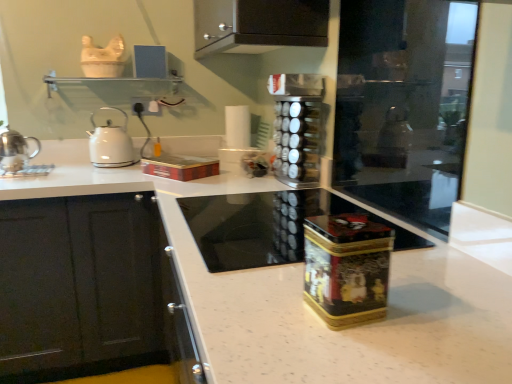
Question: Does metallic red box at center have a lesser height compared to white speckled granite at center?

Choices:
 (A) yes
 (B) no

Answer: (A)

Question: From the image's perspective, is metallic red box at center on top of white speckled granite at center?

Choices:
 (A) yes
 (B) no

Answer: (A)

Question: Is metallic red box at center positioned behind white speckled granite at center?

Choices:
 (A) yes
 (B) no

Answer: (A)

Question: Is white speckled granite at center inside metallic red box at center?

Choices:
 (A) yes
 (B) no

Answer: (B)

Question: Can you confirm if metallic red box at center is taller than white speckled granite at center?

Choices:
 (A) no
 (B) yes

Answer: (A)

Question: From the image's perspective, is metallic red box at center beneath white speckled granite at center?

Choices:
 (A) no
 (B) yes

Answer: (A)

Question: Is metallic red box at center positioned in front of metallic gold and black tin at center, which appears as the 2th appliance when viewed from the top?

Choices:
 (A) no
 (B) yes

Answer: (A)

Question: Could you tell me if metallic red box at center is facing metallic gold and black tin at center, which appears as the 2th appliance when viewed from the top?

Choices:
 (A) no
 (B) yes

Answer: (A)

Question: Are metallic red box at center and metallic gold and black tin at center, which appears as the 2th appliance when viewed from the top, beside each other?

Choices:
 (A) no
 (B) yes

Answer: (A)

Question: Is metallic red box at center not near metallic gold and black tin at center, the 2th appliance in the back-to-front sequence?

Choices:
 (A) no
 (B) yes

Answer: (B)

Question: From the image's perspective, is metallic red box at center on metallic gold and black tin at center, which is the first appliance from bottom to top?

Choices:
 (A) yes
 (B) no

Answer: (A)

Question: Is metallic red box at center outside metallic gold and black tin at center, which is the first appliance from bottom to top?

Choices:
 (A) no
 (B) yes

Answer: (B)

Question: Could metallic red box at center be considered to be inside black metallic spice rack at center, placed as the first appliance when sorted from top to bottom?

Choices:
 (A) yes
 (B) no

Answer: (B)